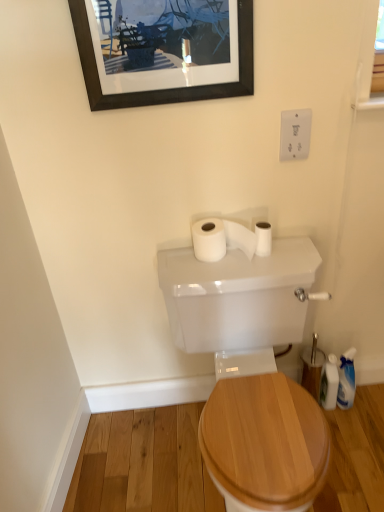
At what (x,y) coordinates should I click in order to perform the action: click on vacant space that is to the left of white matte toilet paper at upper center, placed as the 1th toilet paper when sorted from right to left. Please return your answer as a coordinate pair (x, y). Looking at the image, I should click on (213, 264).